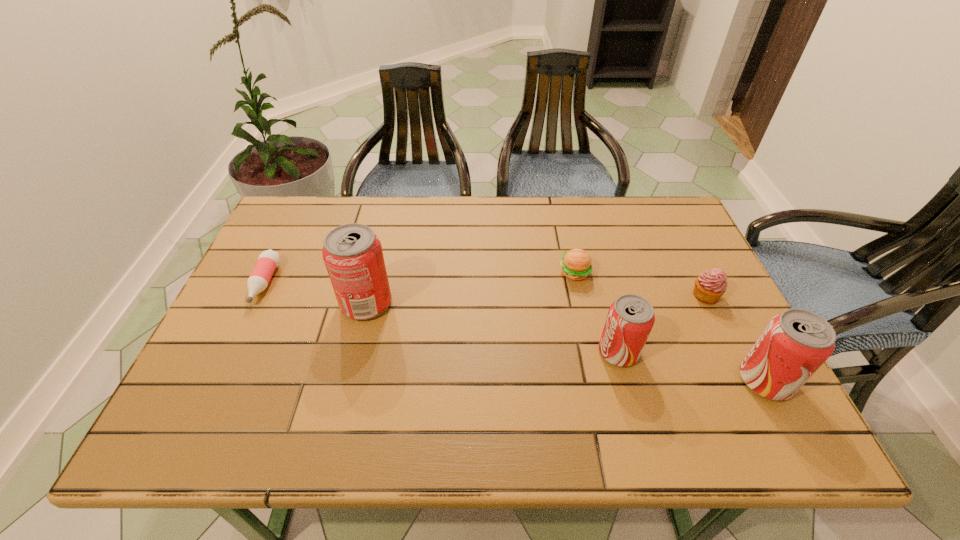
To achieve even spacing by inserting another pop_(soda) among them, please point to a vacant spot for this new pop_(soda). Please provide its 2D coordinates. Your answer should be formatted as a tuple, i.e. [(x, y)], where the tuple contains the x and y coordinates of a point satisfying the conditions above.

[(486, 326)]